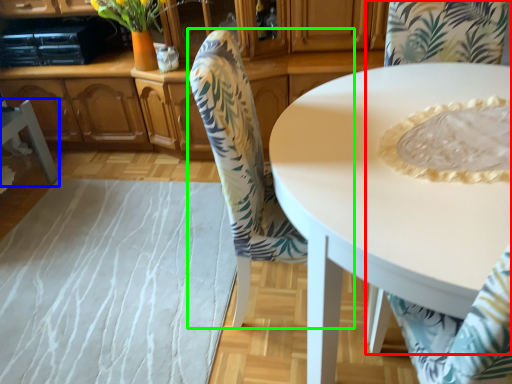
Question: Which is nearer to the chair (highlighted by a red box)? chair (highlighted by a blue box) or chair (highlighted by a green box).

Choices:
 (A) chair
 (B) chair

Answer: (B)